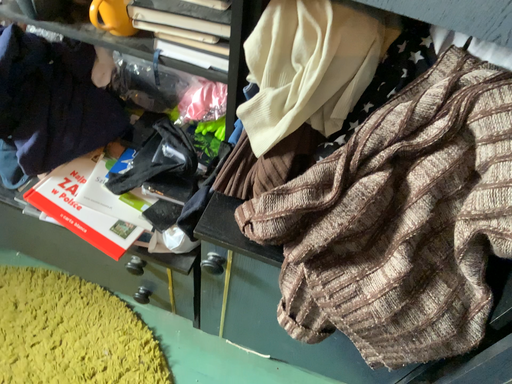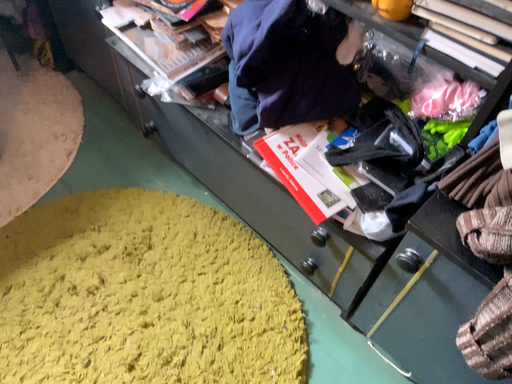
Question: Which way did the camera rotate in the video?

Choices:
 (A) rotated left
 (B) rotated right

Answer: (A)